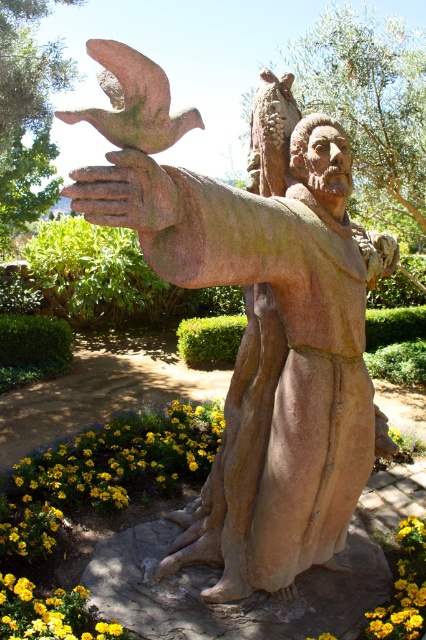
Question: Among these objects, which one is nearest to the camera?

Choices:
 (A) yellow matte flower at lower left
 (B) yellow/yellowish-green petals at lower right
 (C) yellowfloralflower at lower left

Answer: (A)

Question: Can you confirm if bronze statue at center is bigger than yellow/yellowish-green petals at lower right?

Choices:
 (A) yes
 (B) no

Answer: (A)

Question: Does bronze statue at center appear under yellowfloralflower at lower left?

Choices:
 (A) yes
 (B) no

Answer: (B)

Question: Can you confirm if yellowfloralflower at lower left is positioned to the left of yellow/yellowish-green petals at lower right?

Choices:
 (A) no
 (B) yes

Answer: (B)

Question: Among these objects, which one is nearest to the camera?

Choices:
 (A) yellowfloralflower at lower left
 (B) yellow/yellowish-green petals at lower right

Answer: (A)

Question: Among these points, which one is farthest from the camera?

Choices:
 (A) (175, 477)
 (B) (69, 193)
 (C) (184, 234)
 (D) (51, 611)

Answer: (A)